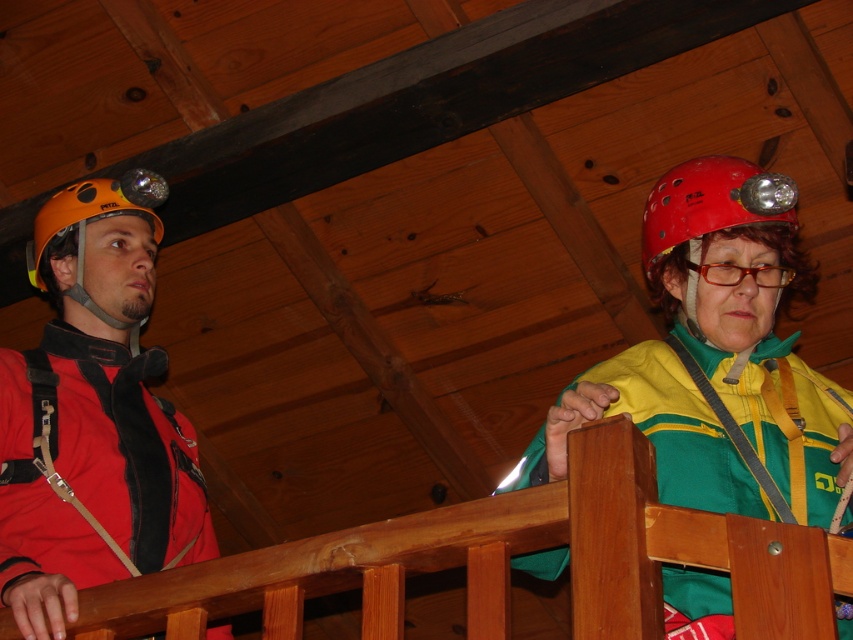
Who is more distant from viewer, (106,564) or (53,208)?

Point (53,208)

Does point (111, 180) come farther from viewer compared to point (142, 170)?

No, (111, 180) is closer to viewer.

Is point (100, 349) behind point (86, 193)?

No.

Where is `matte orange helmet at left`? This screenshot has width=853, height=640. matte orange helmet at left is located at coordinates (94, 416).

Which is in front, point (114, 262) or point (724, 262)?

Point (724, 262)

I want to click on matte orange helmet at left, so click(94, 416).

I want to click on matte orange helmet at left, so click(x=94, y=416).

Between point (785, 209) and point (717, 272), which one is positioned behind?

Positioned behind is point (785, 209).

Between point (738, 172) and point (764, 282), which one is positioned in front?

Point (764, 282) is more forward.

Between point (671, 221) and point (776, 284), which one is positioned in front?

Positioned in front is point (776, 284).

Identify the location of red matte helmet at upper right. The width and height of the screenshot is (853, 640). click(711, 202).